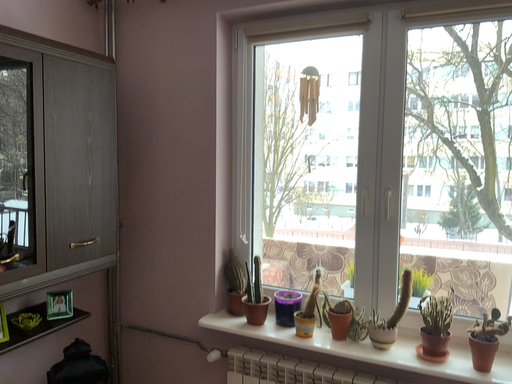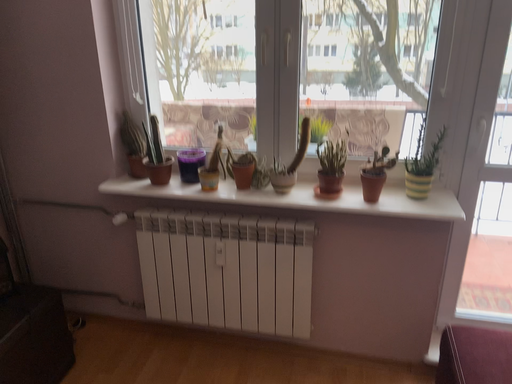
Question: Which way did the camera rotate in the video?

Choices:
 (A) rotated left
 (B) rotated right

Answer: (B)